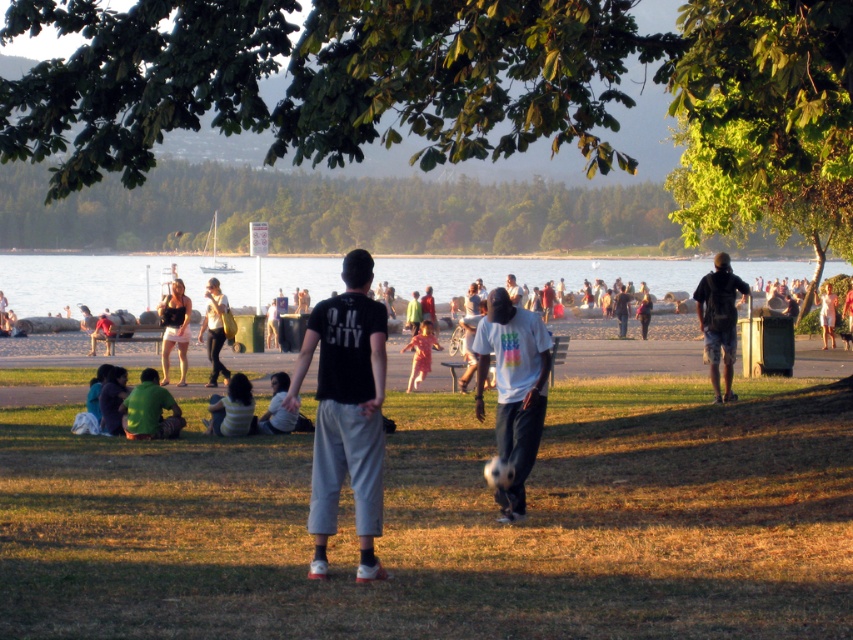
Question: Is the position of green matte shirt at lower left less distant than that of matte black shorts at center?

Choices:
 (A) no
 (B) yes

Answer: (B)

Question: Among these objects, which one is farthest from the camera?

Choices:
 (A) green matte shirt at lower left
 (B) camouflage shorts at right
 (C) matte yellow shirt at center

Answer: (C)

Question: Which object is positioned closest to the matte yellow shirt at center?

Choices:
 (A) green matte shirt at lower left
 (B) green leafy tree at upper center
 (C) black cotton t-shirt at center

Answer: (A)

Question: Does white cotton shirt at center appear on the left side of green fabric shirt at lower left?

Choices:
 (A) no
 (B) yes

Answer: (A)

Question: Is green matte shirt at lower left below striped shirt at center?

Choices:
 (A) no
 (B) yes

Answer: (A)

Question: Which object is farther from the camera taking this photo?

Choices:
 (A) black cotton t-shirt at center
 (B) green fabric shirt at lower left
 (C) white matte shirt at center

Answer: (B)